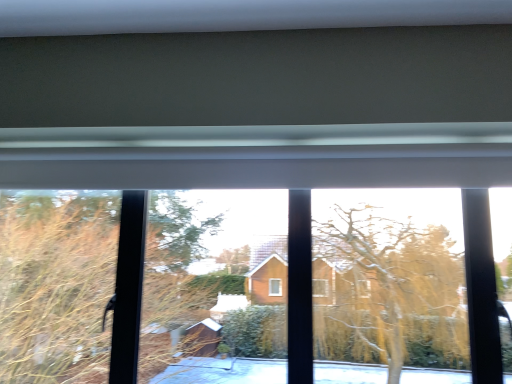
This screenshot has height=384, width=512. What do you see at coordinates (259, 166) in the screenshot?
I see `transparent glass window at center` at bounding box center [259, 166].

Locate an element on the screen. transparent glass window at center is located at coordinates (259, 166).

Where is `transparent glass window at center`? The width and height of the screenshot is (512, 384). transparent glass window at center is located at coordinates (259, 166).